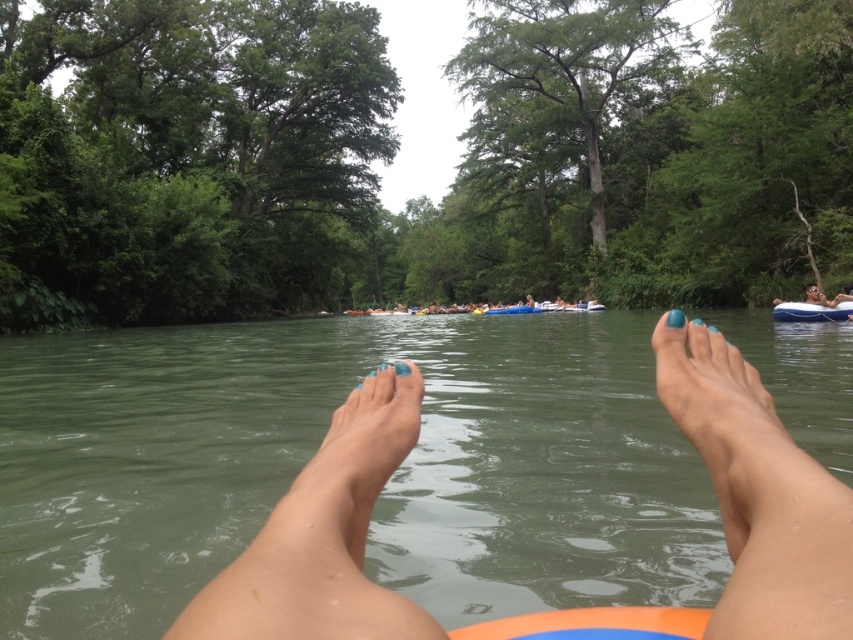
Question: Which point is farther to the camera?

Choices:
 (A) (314, 596)
 (B) (349, 509)
 (C) (801, 314)

Answer: (C)

Question: Is blue painted nails at center above blue inflatable raft at right?

Choices:
 (A) no
 (B) yes

Answer: (A)

Question: Which of the following is the farthest from the observer?

Choices:
 (A) blue painted nails at center
 (B) blue inflatable raft at right
 (C) teal matte foot at center
 (D) blue matte foot at center

Answer: (B)

Question: Can you confirm if blue matte foot at center is smaller than blue inflatable raft at right?

Choices:
 (A) no
 (B) yes

Answer: (B)

Question: Which of the following is the farthest from the observer?

Choices:
 (A) (363, 540)
 (B) (704, 451)
 (C) (830, 314)

Answer: (C)

Question: Is blue painted nails at center wider than teal matte foot at center?

Choices:
 (A) yes
 (B) no

Answer: (A)